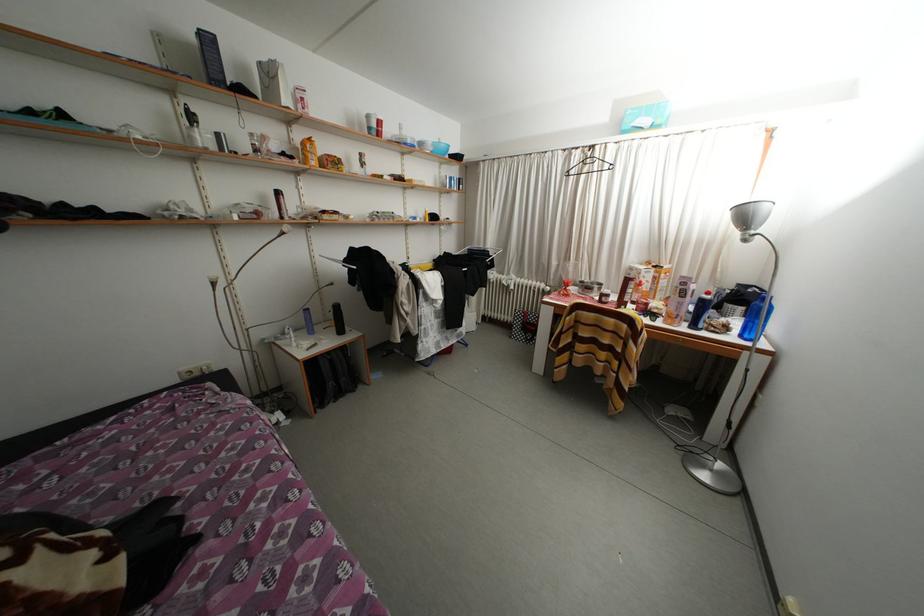
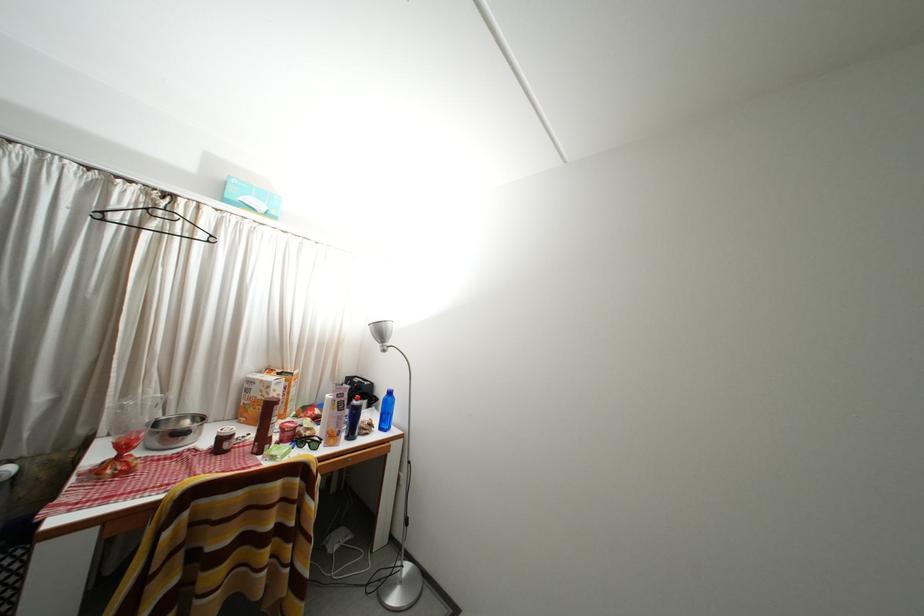
Find the pixel in the second image that matches (752,223) in the first image.

(388, 338)